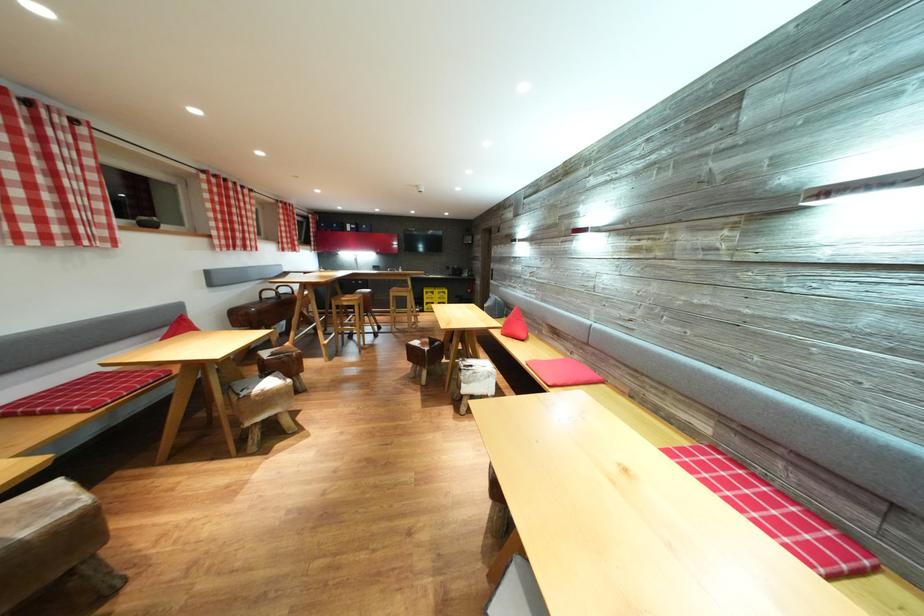
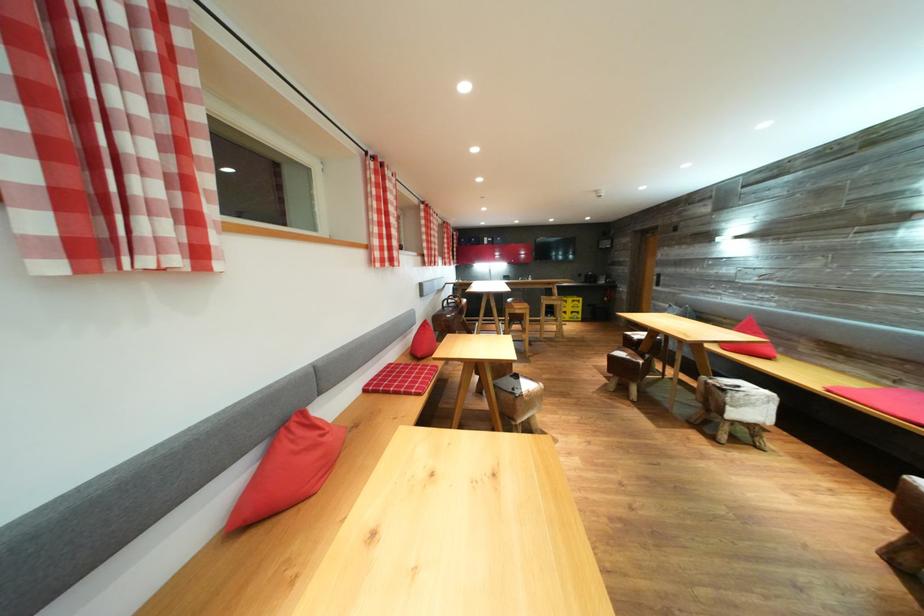
Where in the second image is the point corresponding to point (478, 371) from the first image?

(745, 392)